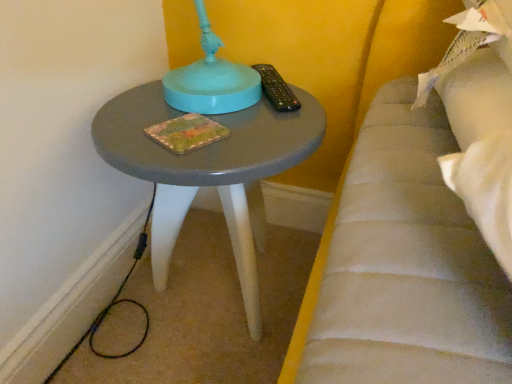
The width and height of the screenshot is (512, 384). I want to click on vacant point above matte gray table at center (from a real-world perspective), so click(x=197, y=114).